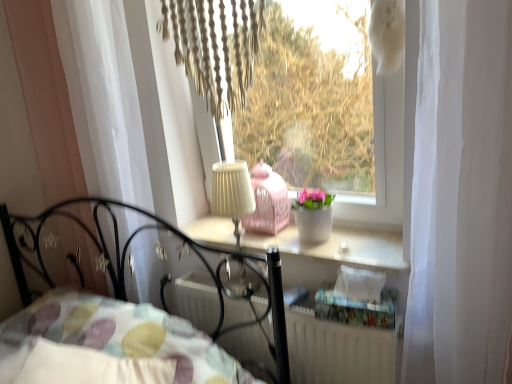
Question: Is white sheer curtain at left facing towards white textured radiator at lower center?

Choices:
 (A) no
 (B) yes

Answer: (A)

Question: Is white sheer curtain at left not within white textured radiator at lower center?

Choices:
 (A) yes
 (B) no

Answer: (A)

Question: From the image's perspective, is white sheer curtain at left located beneath white textured radiator at lower center?

Choices:
 (A) no
 (B) yes

Answer: (A)

Question: Is white sheer curtain at left shorter than white textured radiator at lower center?

Choices:
 (A) no
 (B) yes

Answer: (A)

Question: Can you confirm if white sheer curtain at left is positioned to the right of white textured radiator at lower center?

Choices:
 (A) yes
 (B) no

Answer: (B)

Question: Looking at the image, does white textured radiator at lower center seem bigger or smaller compared to patterned fabric pillow at lower left?

Choices:
 (A) small
 (B) big

Answer: (A)

Question: Is white textured radiator at lower center inside the boundaries of patterned fabric pillow at lower left, or outside?

Choices:
 (A) inside
 (B) outside

Answer: (B)

Question: Is point (361, 369) closer or farther from the camera than point (24, 329)?

Choices:
 (A) closer
 (B) farther

Answer: (A)

Question: From a real-world perspective, is white textured radiator at lower center above or below patterned fabric pillow at lower left?

Choices:
 (A) above
 (B) below

Answer: (B)

Question: From a real-world perspective, is beige fabric lampshade at center above or below white matte window sill at center?

Choices:
 (A) below
 (B) above

Answer: (B)

Question: Is beige fabric lampshade at center inside or outside of white matte window sill at center?

Choices:
 (A) inside
 (B) outside

Answer: (B)

Question: Considering the positions of beige fabric lampshade at center and white matte window sill at center in the image, is beige fabric lampshade at center wider or thinner than white matte window sill at center?

Choices:
 (A) thin
 (B) wide

Answer: (A)

Question: Is point (243, 294) positioned closer to the camera than point (288, 226)?

Choices:
 (A) closer
 (B) farther

Answer: (A)

Question: From a real-world perspective, relative to beige fabric lampshade at center, is patterned fabric pillow at lower left vertically above or below?

Choices:
 (A) below
 (B) above

Answer: (A)

Question: Based on their sizes in the image, would you say patterned fabric pillow at lower left is bigger or smaller than beige fabric lampshade at center?

Choices:
 (A) big
 (B) small

Answer: (A)